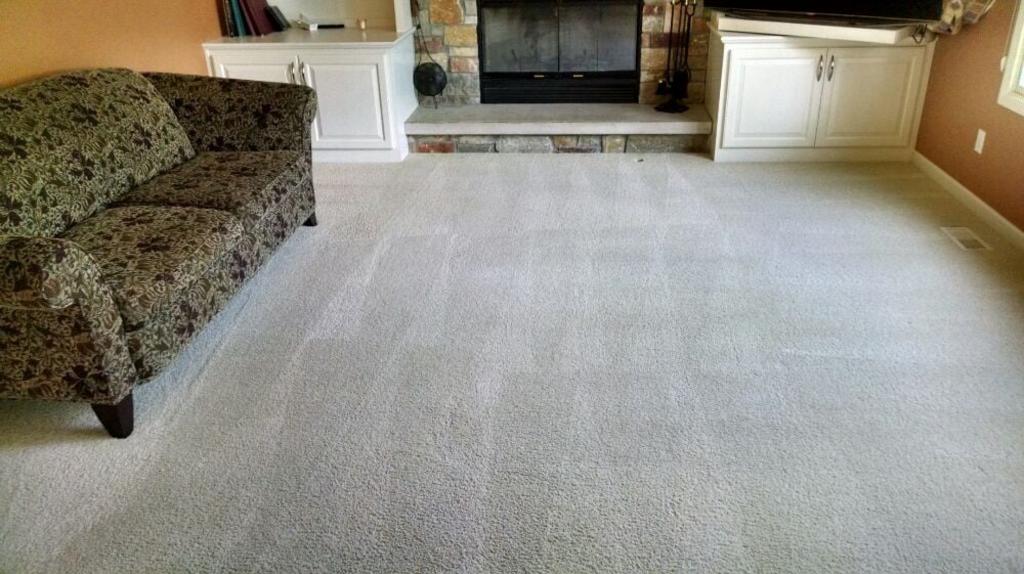
Where is `handle`? The image size is (1024, 574). handle is located at coordinates (829, 68).